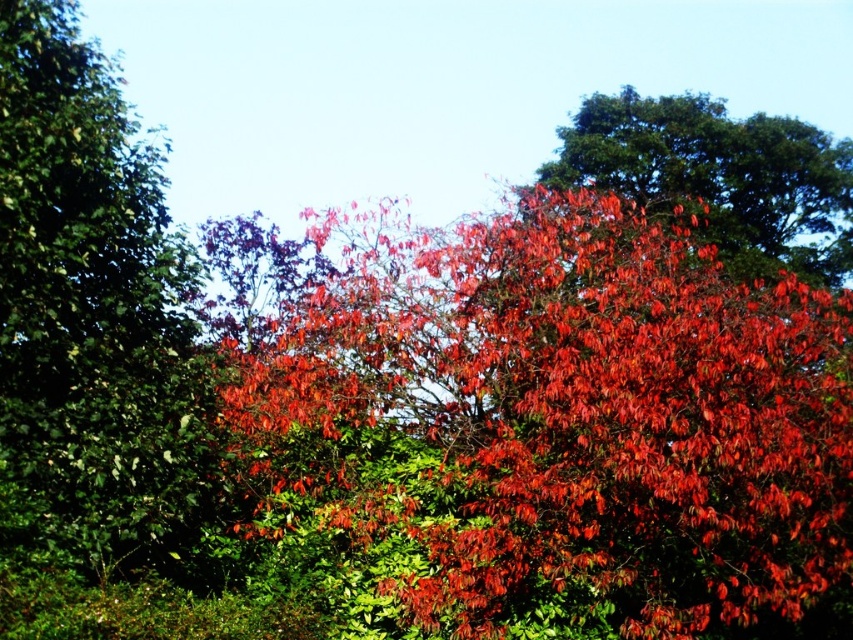
You are standing in the autumnal scene and want to place a small decoration between the two points, point (x=57, y=172) and point (x=770, y=132). Which point should you start placing the decoration closer to to ensure it appears larger in the image?

You should start placing the decoration closer to point (x=57, y=172) because it is closer to the camera, making objects placed there appear larger in the image.

You are an artist planning to paint this autumn scene. You want to ensure the green matte leaves at left and the shiny red leaves at upper right are proportionally accurate. Which leaves should you paint wider to maintain the scene proportions?

The shiny red leaves at upper right should be painted wider since they have a greater width than the green matte leaves at left.

You are an artist trying to paint the autumn scene. You want to ensure the green matte leaves at left and the shiny red leaves at upper right are proportionally accurate. Which of the two has a shorter height?

The green matte leaves at left is not as tall as shiny red leaves at upper right, so the green matte leaves at left are shorter in height.